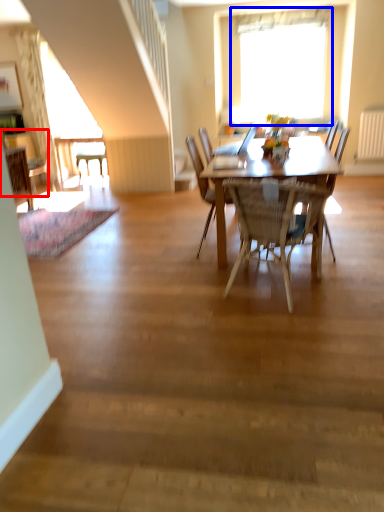
Question: Which point is further to the camera, chair (highlighted by a red box) or window (highlighted by a blue box)?

Choices:
 (A) chair
 (B) window

Answer: (B)